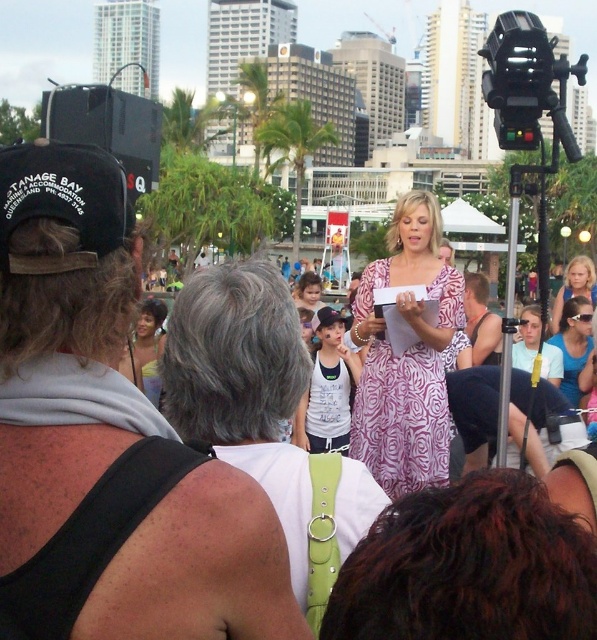
Question: Does white floral dress at center have a lesser width compared to blue fabric sunglasses at center?

Choices:
 (A) yes
 (B) no

Answer: (B)

Question: Can you confirm if white floral dress at center is wider than yellow fabric dress at center?

Choices:
 (A) yes
 (B) no

Answer: (A)

Question: Which point is closer to the camera taking this photo?

Choices:
 (A) (293, 298)
 (B) (444, 301)

Answer: (B)

Question: Based on their relative distances, which object is farther from the light blue denim shorts at center?

Choices:
 (A) blue fabric sunglasses at center
 (B) matte pink dress at center
 (C) yellow fabric dress at center

Answer: (C)

Question: Is pink floral dress at center below blue fabric sunglasses at center?

Choices:
 (A) yes
 (B) no

Answer: (A)

Question: Which object is farther from the camera taking this photo?

Choices:
 (A) matte pink dress at center
 (B) blue fabric sunglasses at center
 (C) pink floral dress at center
 (D) light blue denim shorts at center

Answer: (A)